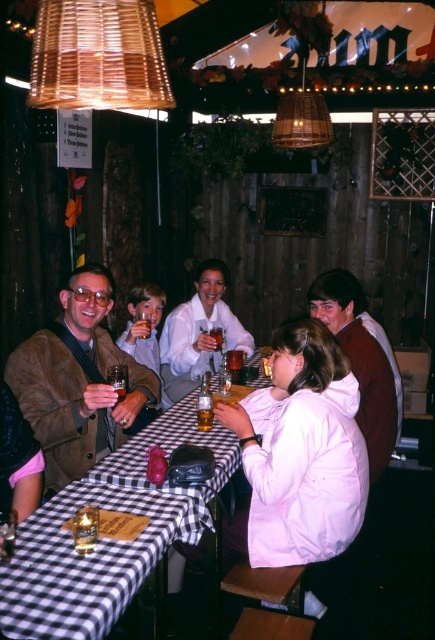
Question: Can you confirm if translucent glass beverage at table center is positioned to the right of translucent glass beer at center?

Choices:
 (A) no
 (B) yes

Answer: (B)

Question: Is maroon sweater at center closer to camera compared to white matte jacket at center?

Choices:
 (A) no
 (B) yes

Answer: (B)

Question: Is maroon sweater at center to the right of translucent glass beverage at table center from the viewer's perspective?

Choices:
 (A) yes
 (B) no

Answer: (A)

Question: Which point appears closest to the camera in this image?

Choices:
 (A) (37, 419)
 (B) (181, 342)

Answer: (A)

Question: Based on their relative distances, which object is farther from the maroon sweater at center?

Choices:
 (A) woven wood lampshade at upper center
 (B) black checkered tablecloth at lower left
 (C) white matte jacket at center

Answer: (A)

Question: Which point is closer to the camera?

Choices:
 (A) brown suede jacket at left
 (B) white matte jacket at center
 (C) translucent glass beverage at table center
 (D) woven wood lampshade at upper center

Answer: (D)